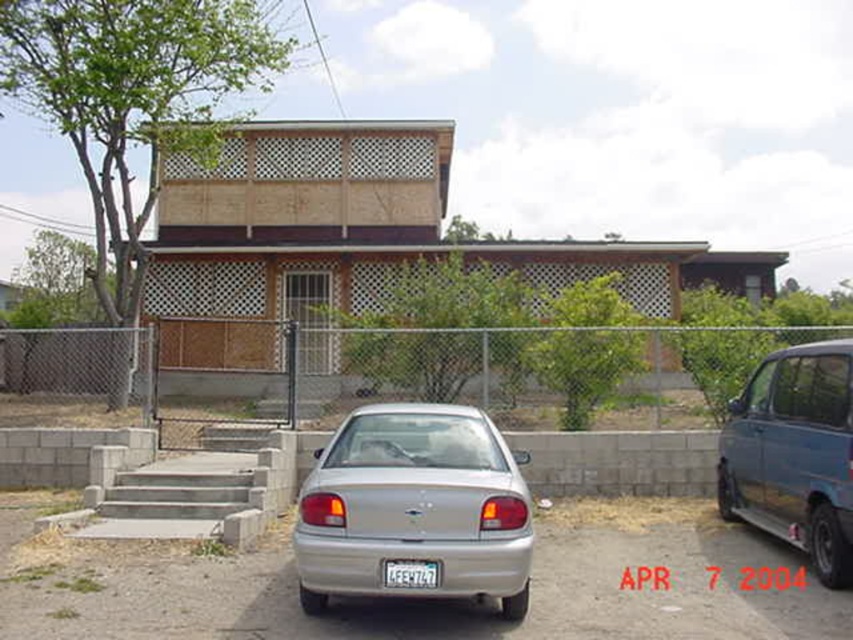
Between point (340, 490) and point (408, 570), which one is positioned in front?

Point (408, 570) is in front.

This screenshot has width=853, height=640. What do you see at coordinates (415, 508) in the screenshot? I see `silver metallic sedan at center` at bounding box center [415, 508].

Is point (498, 588) farther from viewer compared to point (415, 582)?

Yes, it is behind point (415, 582).

The image size is (853, 640). I want to click on silver metallic sedan at center, so click(415, 508).

Which is more to the right, metallic blue minivan at right or white plastic license plate at center?

metallic blue minivan at right is more to the right.

Between point (824, 561) and point (392, 579), which one is positioned in front?

Point (392, 579) is more forward.

This screenshot has width=853, height=640. I want to click on metallic blue minivan at right, so click(793, 454).

Looking at this image, is silver metallic sedan at center taller than metallic blue minivan at right?

In fact, silver metallic sedan at center may be shorter than metallic blue minivan at right.

Does point (381, 516) come behind point (718, 490)?

No, it is not.

Image resolution: width=853 pixels, height=640 pixels. Identify the location of silver metallic sedan at center. (415, 508).